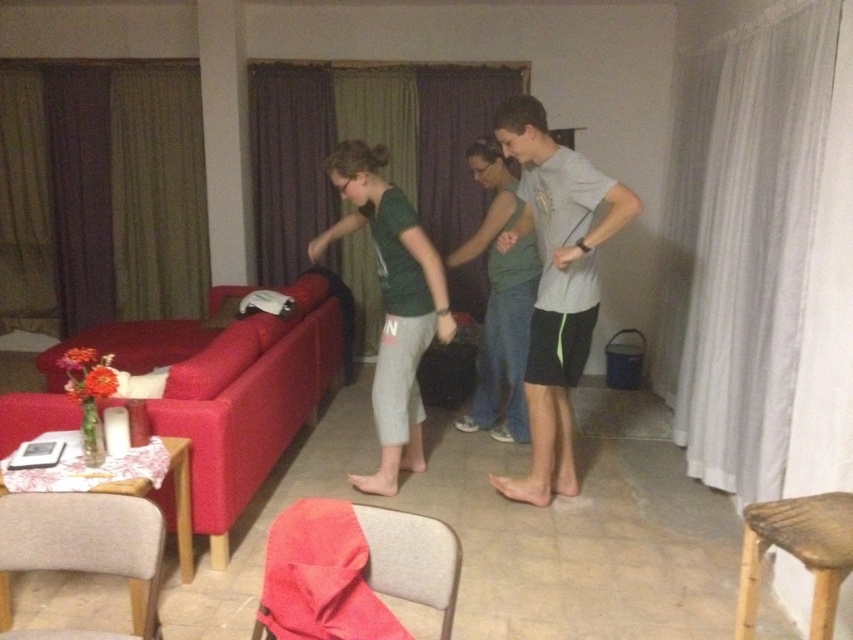
Does green cotton shirt at center appear under green matte shirt at center?

Actually, green cotton shirt at center is above green matte shirt at center.

Does green cotton shirt at center appear over green matte shirt at center?

Yes.

At what (x,y) coordinates should I click in order to perform the action: click on green cotton shirt at center. Please return your answer as a coordinate pair (x, y). The width and height of the screenshot is (853, 640). Looking at the image, I should click on (555, 284).

Find the location of `green cotton shirt at center`. green cotton shirt at center is located at coordinates (555, 284).

Between matte green tank top at center and bamboo stool at lower right, which one has less height?

bamboo stool at lower right

This screenshot has height=640, width=853. Find the location of `matte green tank top at center`. matte green tank top at center is located at coordinates (500, 301).

I want to click on matte green tank top at center, so click(x=500, y=301).

Does gray matte t-shirt at center appear on the left side of green matte shirt at center?

Incorrect, gray matte t-shirt at center is not on the left side of green matte shirt at center.

Can you confirm if gray matte t-shirt at center is wider than green matte shirt at center?

In fact, gray matte t-shirt at center might be narrower than green matte shirt at center.

Image resolution: width=853 pixels, height=640 pixels. What do you see at coordinates (555, 284) in the screenshot? I see `gray matte t-shirt at center` at bounding box center [555, 284].

The width and height of the screenshot is (853, 640). In order to click on gray matte t-shirt at center in this screenshot , I will do pos(555,284).